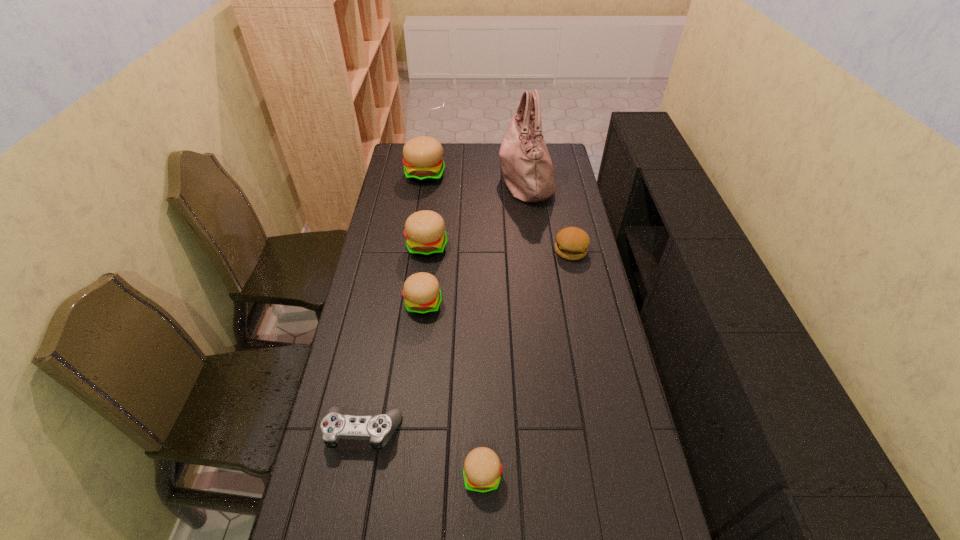
The image size is (960, 540). What are the coordinates of `white control` in the screenshot? It's located at (378, 429).

Find the location of a particular element. control is located at coordinates (378, 429).

The height and width of the screenshot is (540, 960). In order to click on free region located at the front of the handbag with handles in this screenshot , I will do click(451, 178).

What are the coordinates of `vacant area situated 0.130m at the front of the handbag with handles` in the screenshot? It's located at (470, 178).

Identify the location of vacant space located 0.330m at the front of the handbag with handles. This screenshot has height=540, width=960. (428, 178).

Where is `free space located on the right of the farthest hamburger`? The height and width of the screenshot is (540, 960). free space located on the right of the farthest hamburger is located at coordinates (498, 174).

This screenshot has height=540, width=960. In order to click on vacant region located on the back of the second biggest beige hamburger in this screenshot , I will do `click(430, 221)`.

Identify the location of vacant area situated on the left of the third farthest beige hamburger. (381, 304).

Where is `free space located 0.210m on the front of the brown hamburger`? Image resolution: width=960 pixels, height=540 pixels. free space located 0.210m on the front of the brown hamburger is located at coordinates (582, 303).

At what (x,y) coordinates should I click in order to perform the action: click on free space located on the left of the fifth object from left to right. Please return your answer as a coordinate pair (x, y). Looking at the image, I should click on (330, 475).